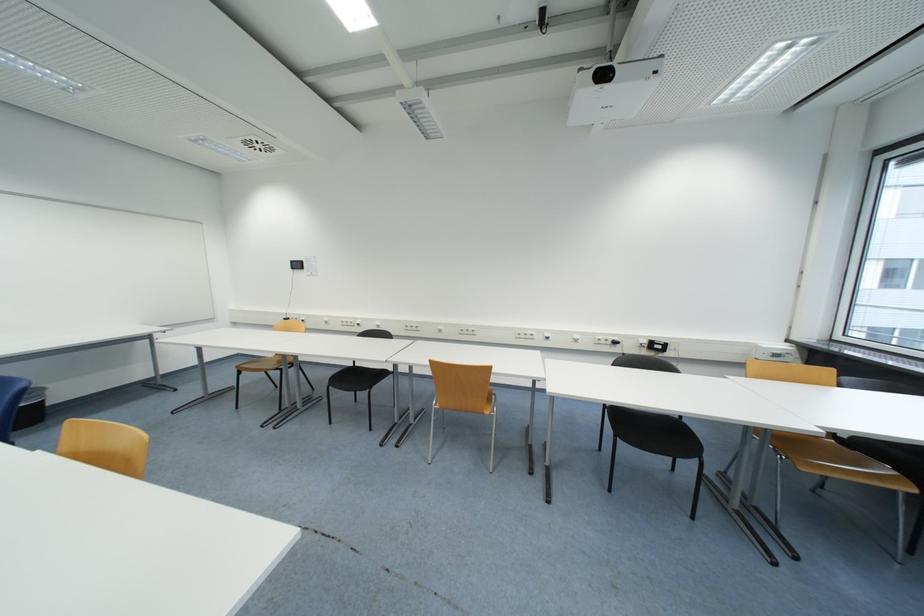
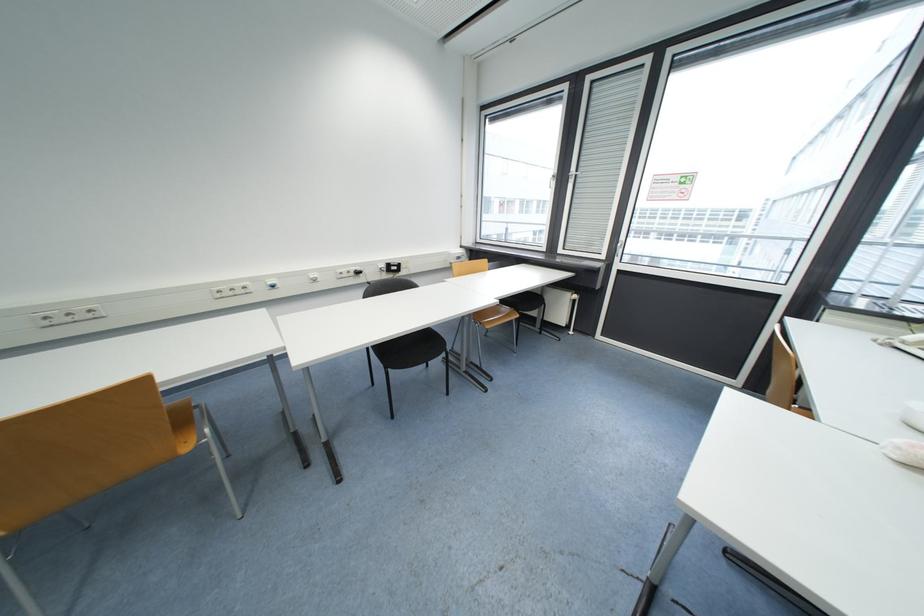
The point at (891, 471) is marked in the first image. Where is the corresponding point in the second image?

(512, 310)